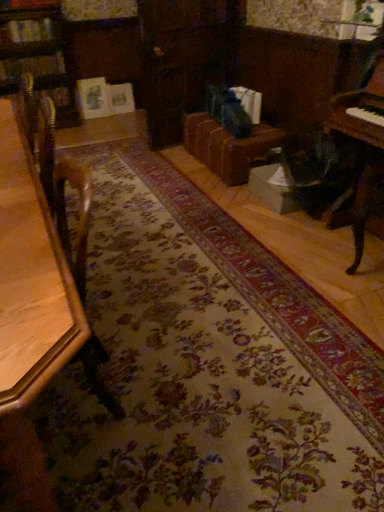
Question: From the image's perspective, is wooden table at left under wooden piano at right?

Choices:
 (A) yes
 (B) no

Answer: (A)

Question: Does wooden table at left have a greater height compared to wooden piano at right?

Choices:
 (A) no
 (B) yes

Answer: (B)

Question: Is wooden table at left smaller than wooden piano at right?

Choices:
 (A) no
 (B) yes

Answer: (A)

Question: From a real-world perspective, does wooden table at left sit lower than wooden piano at right?

Choices:
 (A) yes
 (B) no

Answer: (A)

Question: Is wooden table at left facing towards wooden piano at right?

Choices:
 (A) yes
 (B) no

Answer: (B)

Question: In the image, is wooden table at left positioned in front of or behind wooden piano at right?

Choices:
 (A) behind
 (B) front

Answer: (B)

Question: Is point (49, 335) positioned closer to the camera than point (345, 114)?

Choices:
 (A) closer
 (B) farther

Answer: (A)

Question: Considering the positions of wooden table at left and wooden piano at right in the image, is wooden table at left bigger or smaller than wooden piano at right?

Choices:
 (A) small
 (B) big

Answer: (B)

Question: From a real-world perspective, is wooden table at left above or below wooden piano at right?

Choices:
 (A) above
 (B) below

Answer: (B)

Question: From a real-world perspective, is brown leather couch at center positioned above or below wooden table at left?

Choices:
 (A) above
 (B) below

Answer: (B)

Question: Is point (276, 131) positioned closer to the camera than point (31, 177)?

Choices:
 (A) farther
 (B) closer

Answer: (A)

Question: Is brown leather couch at center spatially inside wooden table at left, or outside of it?

Choices:
 (A) inside
 (B) outside

Answer: (B)

Question: Is brown leather couch at center taller or shorter than wooden table at left?

Choices:
 (A) short
 (B) tall

Answer: (A)

Question: Considering the positions of wooden piano at right and brown leather couch at center in the image, is wooden piano at right taller or shorter than brown leather couch at center?

Choices:
 (A) short
 (B) tall

Answer: (B)

Question: From a real-world perspective, is wooden piano at right physically located above or below brown leather couch at center?

Choices:
 (A) below
 (B) above

Answer: (B)